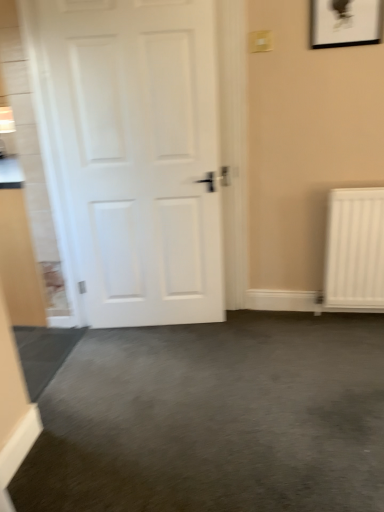
Question: From the image's perspective, is matte black picture frame at upper right located beneath white matte door at left?

Choices:
 (A) yes
 (B) no

Answer: (B)

Question: From the image's perspective, is matte black picture frame at upper right on white matte door at left?

Choices:
 (A) no
 (B) yes

Answer: (B)

Question: Considering the relative sizes of matte black picture frame at upper right and white matte door at left in the image provided, is matte black picture frame at upper right bigger than white matte door at left?

Choices:
 (A) no
 (B) yes

Answer: (A)

Question: Can you confirm if matte black picture frame at upper right is positioned to the left of white matte door at left?

Choices:
 (A) yes
 (B) no

Answer: (B)

Question: Is matte black picture frame at upper right facing towards white matte door at left?

Choices:
 (A) yes
 (B) no

Answer: (B)

Question: Is matte black picture frame at upper right not close to white matte door at left?

Choices:
 (A) no
 (B) yes

Answer: (B)

Question: Is white matte door at left taller than matte black picture frame at upper right?

Choices:
 (A) no
 (B) yes

Answer: (B)

Question: Can you see white matte door at left touching matte black picture frame at upper right?

Choices:
 (A) no
 (B) yes

Answer: (A)

Question: Considering the relative sizes of white matte door at left and matte black picture frame at upper right in the image provided, is white matte door at left smaller than matte black picture frame at upper right?

Choices:
 (A) no
 (B) yes

Answer: (A)

Question: Is white matte door at left facing towards matte black picture frame at upper right?

Choices:
 (A) no
 (B) yes

Answer: (A)

Question: Is white matte door at left closer to camera compared to matte black picture frame at upper right?

Choices:
 (A) no
 (B) yes

Answer: (B)

Question: Does white matte door at left have a greater width compared to matte black picture frame at upper right?

Choices:
 (A) no
 (B) yes

Answer: (B)

Question: Based on their positions, is white matte door at left located to the left or right of matte black picture frame at upper right?

Choices:
 (A) left
 (B) right

Answer: (A)